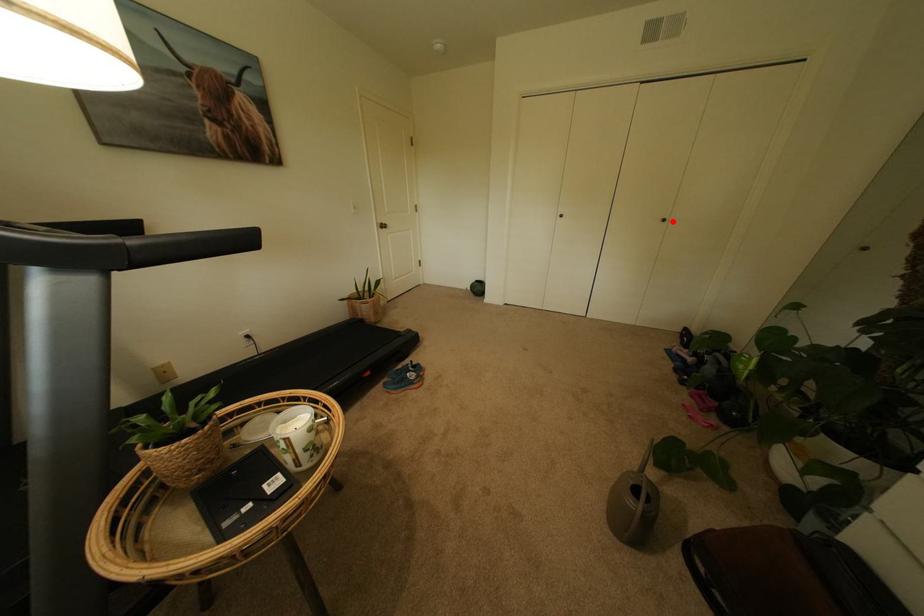
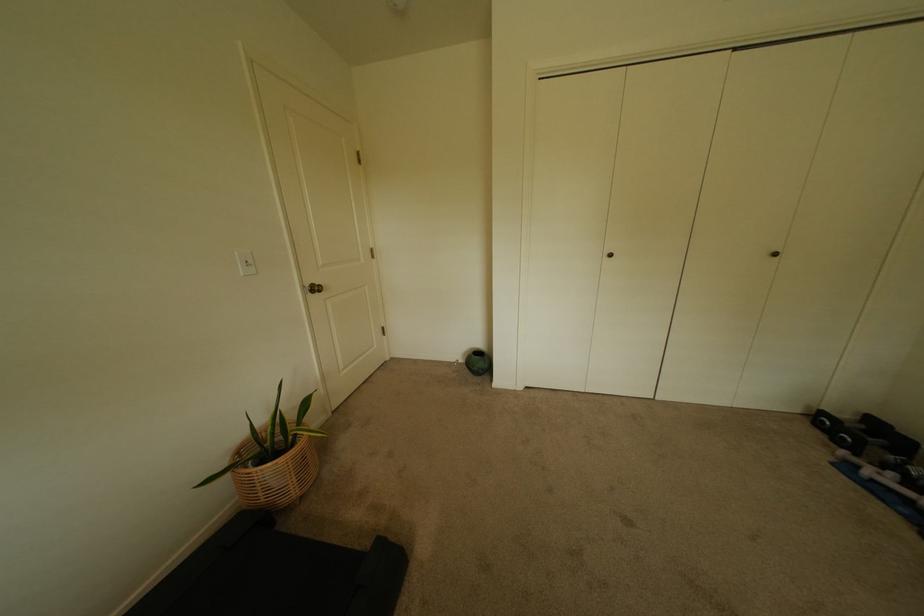
The point at the highlighted location is marked in the first image. Where is the corresponding point in the second image?

(784, 256)